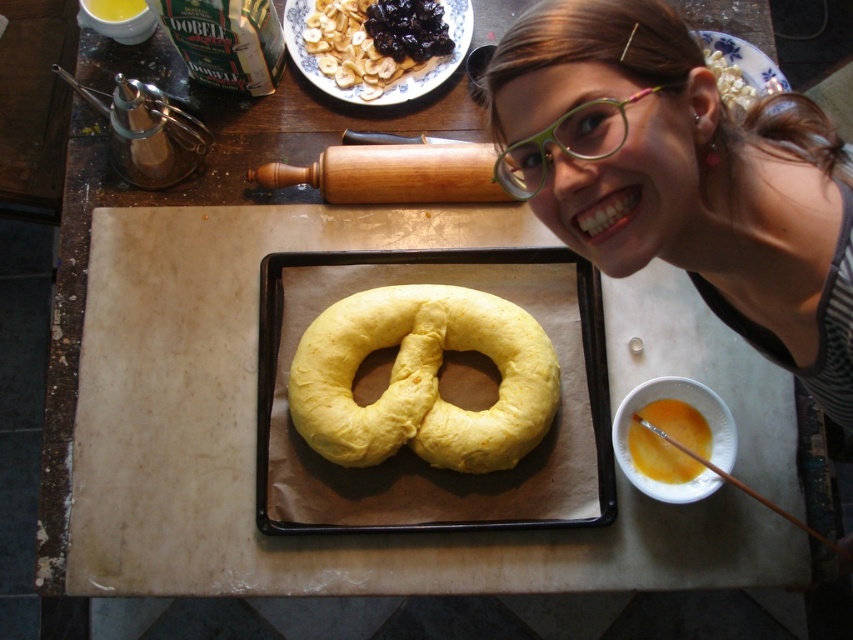
Question: In this image, where is matte yellow pretzel at center located relative to yellow doughnut at center?

Choices:
 (A) above
 (B) below

Answer: (A)

Question: Which of the following is the closest to the observer?

Choices:
 (A) yellow matte egg yolk at center
 (B) green plastic glasses at upper center
 (C) shiny dark blue dried fruit at upper center

Answer: (B)

Question: Does yellow doughnut at center come in front of shiny dark blue dried fruit at upper center?

Choices:
 (A) no
 (B) yes

Answer: (B)

Question: Which point is closer to the camera?

Choices:
 (A) green plastic glasses at upper center
 (B) shiny dark blue dried fruit at upper center
 (C) matte yellow pretzel at center
 (D) yellow matte egg yolk at center

Answer: (A)

Question: Does green plastic glasses at upper center appear on the left side of yellow matte egg yolk at center?

Choices:
 (A) yes
 (B) no

Answer: (A)

Question: Which is farther from the green plastic glasses at upper center?

Choices:
 (A) shiny dark blue dried fruit at upper center
 (B) yellow doughnut at center
 (C) matte yellow pretzel at center
 (D) yellow matte egg yolk at center

Answer: (A)